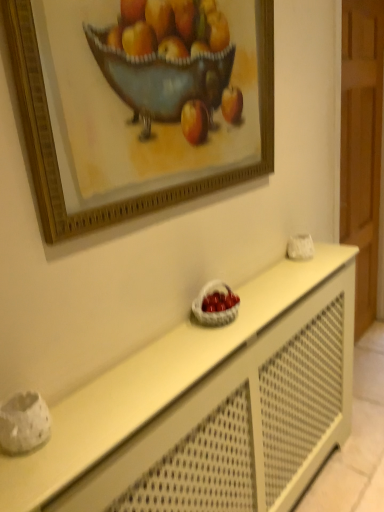
Where is `unoccupied area in front of white woven basket at center`? This screenshot has height=512, width=384. unoccupied area in front of white woven basket at center is located at coordinates (203, 347).